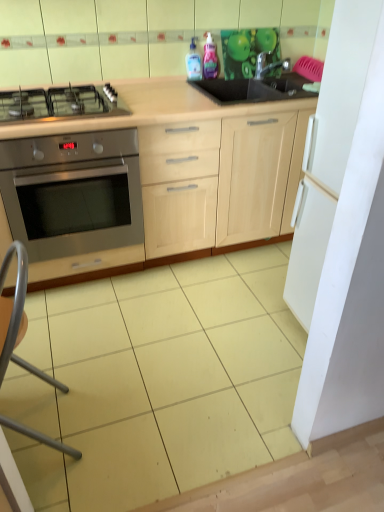
Locate an element on the screen. Image resolution: width=384 pixels, height=512 pixels. metallic faucet at upper right is located at coordinates (268, 65).

You are a GUI agent. You are given a task and a screenshot of the screen. Output one action in this format:
    pyautogui.click(x=<x>, y=<y>)
    Task: Click on the light wood cabinet at center
    This screenshot has width=384, height=512.
    Given the screenshot: What is the action you would take?
    pyautogui.click(x=153, y=176)

What is the approximate width of transparent plastic bottle at upper center, the 1th bottle positioned from the left?

transparent plastic bottle at upper center, the 1th bottle positioned from the left, is 8.18 centimeters in width.

What is the approximate height of metallic silver folding chair at lower left?

75.36 centimeters.

Image resolution: width=384 pixels, height=512 pixels. I want to click on stainless steel oven at left, so click(73, 192).

In order to face pink glossy bottle at upper center, the first bottle when ordered from right to left, should I rotate leftwards or rightwards?

Turn right by 2.579 degrees to look at pink glossy bottle at upper center, the first bottle when ordered from right to left.

The image size is (384, 512). What do you see at coordinates (60, 102) in the screenshot? I see `satin silver gas stove at left` at bounding box center [60, 102].

Locate an element on the screen. The height and width of the screenshot is (512, 384). satin silver gas stove at left is located at coordinates (60, 102).

Locate an element on the screen. metallic faucet at upper right is located at coordinates tap(268, 65).

What are the coordinates of `bottle below the pink glossy bottle at upper center, the first bottle when ordered from right to left (from the image's perspective)` in the screenshot? It's located at (193, 62).

From the picture: From a real-world perspective, is transparent plastic bottle at upper center, the 1th bottle positioned from the left, physically located above or below pink glossy bottle at upper center, the 2th bottle positioned from the left?

transparent plastic bottle at upper center, the 1th bottle positioned from the left, is below pink glossy bottle at upper center, the 2th bottle positioned from the left.

Can you confirm if transparent plastic bottle at upper center, the 1th bottle positioned from the left, is smaller than pink glossy bottle at upper center, the 2th bottle positioned from the left?

No, transparent plastic bottle at upper center, the 1th bottle positioned from the left, is not smaller than pink glossy bottle at upper center, the 2th bottle positioned from the left.

How far apart are stainless steel oven at left and metallic silver folding chair at lower left?

15.73 inches.

Considering the sizes of stainless steel oven at left and metallic silver folding chair at lower left in the image, is stainless steel oven at left wider or thinner than metallic silver folding chair at lower left?

Considering their sizes, stainless steel oven at left looks broader than metallic silver folding chair at lower left.

The height and width of the screenshot is (512, 384). Identify the location of oven on the left of metallic silver folding chair at lower left. (73, 192).

Which is correct: stainless steel oven at left is inside metallic silver folding chair at lower left, or outside of it?

stainless steel oven at left is outside metallic silver folding chair at lower left.

Consider the image. Measure the distance from stainless steel oven at left to transparent plastic bottle at upper center, which ranks as the second bottle in right-to-left order.

stainless steel oven at left is 36.18 inches away from transparent plastic bottle at upper center, which ranks as the second bottle in right-to-left order.

From a real-world perspective, between stainless steel oven at left and transparent plastic bottle at upper center, which ranks as the second bottle in right-to-left order, who is vertically higher?

transparent plastic bottle at upper center, which ranks as the second bottle in right-to-left order, from a real-world perspective.

Is stainless steel oven at left looking in the opposite direction of transparent plastic bottle at upper center, the 1th bottle positioned from the left?

stainless steel oven at left does not have its back to transparent plastic bottle at upper center, the 1th bottle positioned from the left.

Considering the sizes of metallic faucet at upper right and metallic silver folding chair at lower left in the image, is metallic faucet at upper right bigger or smaller than metallic silver folding chair at lower left?

In the image, metallic faucet at upper right appears to be smaller than metallic silver folding chair at lower left.

Can metallic silver folding chair at lower left be found inside metallic faucet at upper right?

Definitely not — metallic silver folding chair at lower left is not inside metallic faucet at upper right.

Locate an element on the screen. The image size is (384, 512). folding chair below the metallic faucet at upper right (from a real-world perspective) is located at coordinates (17, 316).

Considering the sizes of objects light wood cabinet at center and stainless steel oven at left in the image provided, who is shorter, light wood cabinet at center or stainless steel oven at left?

Standing shorter between the two is stainless steel oven at left.

From a real-world perspective, between light wood cabinet at center and stainless steel oven at left, who is vertically lower?

stainless steel oven at left.

Considering the relative sizes of light wood cabinet at center and stainless steel oven at left in the image provided, is light wood cabinet at center thinner than stainless steel oven at left?

Correct, the width of light wood cabinet at center is less than that of stainless steel oven at left.

Locate an element on the screen. This screenshot has width=384, height=512. gas stove on the right of stainless steel oven at left is located at coordinates (60, 102).

Considering the sizes of objects satin silver gas stove at left and stainless steel oven at left in the image provided, who is wider, satin silver gas stove at left or stainless steel oven at left?

Wider between the two is stainless steel oven at left.

Is point (100, 89) closer to camera compared to point (107, 229)?

No, (100, 89) is behind (107, 229).

From a real-world perspective, is satin silver gas stove at left on metallic silver folding chair at lower left?

Yes, from a real-world perspective, satin silver gas stove at left is above metallic silver folding chair at lower left.

Considering the relative positions of satin silver gas stove at left and metallic silver folding chair at lower left in the image provided, is satin silver gas stove at left behind metallic silver folding chair at lower left?

Yes, it is behind metallic silver folding chair at lower left.

Image resolution: width=384 pixels, height=512 pixels. Find the location of `gas stove behind the metallic silver folding chair at lower left`. gas stove behind the metallic silver folding chair at lower left is located at coordinates (60, 102).

Find the location of a particular element. bottle on the left of pink glossy bottle at upper center, the first bottle when ordered from right to left is located at coordinates (193, 62).

Where is `oven above the metallic silver folding chair at lower left (from a real-world perspective)`? This screenshot has height=512, width=384. oven above the metallic silver folding chair at lower left (from a real-world perspective) is located at coordinates (73, 192).

Looking at the image, which one is located closer to metallic faucet at upper right, metallic silver folding chair at lower left or stainless steel oven at left?

Based on the image, stainless steel oven at left appears to be nearer to metallic faucet at upper right.

Which object lies further to the anchor point light wood cabinet at center, metallic silver folding chair at lower left or transparent plastic bottle at upper center, the 1th bottle positioned from the left?

Among the two, metallic silver folding chair at lower left is located further to light wood cabinet at center.

Estimate the real-world distances between objects in this image. Which object is further from metallic silver folding chair at lower left, transparent plastic bottle at upper center, which ranks as the second bottle in right-to-left order, or metallic faucet at upper right?

metallic faucet at upper right lies further to metallic silver folding chair at lower left than the other object.

From the image, which object appears to be nearer to pink glossy bottle at upper center, the first bottle when ordered from right to left, light wood cabinet at center or stainless steel oven at left?

light wood cabinet at center is closer to pink glossy bottle at upper center, the first bottle when ordered from right to left.

From the image, which object appears to be farther from satin silver gas stove at left, stainless steel oven at left or pink glossy bottle at upper center, the 2th bottle positioned from the left?

Among the two, pink glossy bottle at upper center, the 2th bottle positioned from the left, is located further to satin silver gas stove at left.

In the scene shown: When comparing their distances from pink glossy bottle at upper center, the 2th bottle positioned from the left, does transparent plastic bottle at upper center, the 1th bottle positioned from the left, or metallic silver folding chair at lower left seem closer?

transparent plastic bottle at upper center, the 1th bottle positioned from the left.

From the image, which object appears to be farther from stainless steel oven at left, transparent plastic bottle at upper center, which ranks as the second bottle in right-to-left order, or light wood cabinet at center?

transparent plastic bottle at upper center, which ranks as the second bottle in right-to-left order, is positioned further to the anchor stainless steel oven at left.

Considering their positions, is light wood cabinet at center positioned further to transparent plastic bottle at upper center, which ranks as the second bottle in right-to-left order, than pink glossy bottle at upper center, the first bottle when ordered from right to left?

light wood cabinet at center is further to transparent plastic bottle at upper center, which ranks as the second bottle in right-to-left order.

I want to click on cabinetry between pink glossy bottle at upper center, the first bottle when ordered from right to left, and metallic silver folding chair at lower left from top to bottom, so click(153, 176).

Locate an element on the screen. oven between transparent plastic bottle at upper center, which ranks as the second bottle in right-to-left order, and metallic silver folding chair at lower left vertically is located at coordinates (73, 192).

What are the coordinates of `gas stove between transparent plastic bottle at upper center, the 1th bottle positioned from the left, and stainless steel oven at left in the up-down direction` in the screenshot? It's located at (60, 102).

Where is `gas stove between metallic faucet at upper right and metallic silver folding chair at lower left in the vertical direction`? This screenshot has width=384, height=512. gas stove between metallic faucet at upper right and metallic silver folding chair at lower left in the vertical direction is located at coordinates (60, 102).